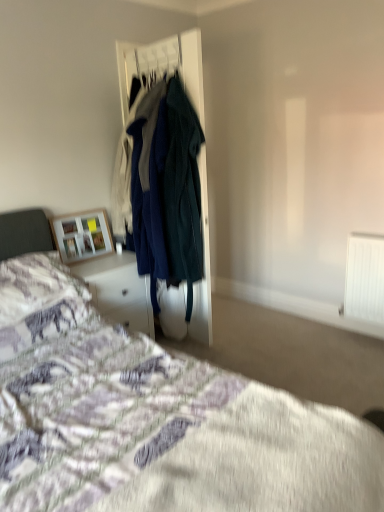
Question: From the image's perspective, is velvet teal coat at center above or below fluffy white pillow at lower left?

Choices:
 (A) below
 (B) above

Answer: (B)

Question: Looking at their shapes, would you say velvet teal coat at center is wider or thinner than fluffy white pillow at lower left?

Choices:
 (A) wide
 (B) thin

Answer: (B)

Question: Which is nearer to the wooden frame at upper left?

Choices:
 (A) purple cotton bedspread at lower left
 (B) dark green wool coat at center
 (C) white glossy vanity at lower left
 (D) fluffy white pillow at lower left
 (E) velvet teal coat at center

Answer: (C)

Question: Which object is the closest to the fluffy white pillow at lower left?

Choices:
 (A) dark green wool coat at center
 (B) white glossy vanity at lower left
 (C) wooden frame at upper left
 (D) purple cotton bedspread at lower left
 (E) velvet teal coat at center

Answer: (D)